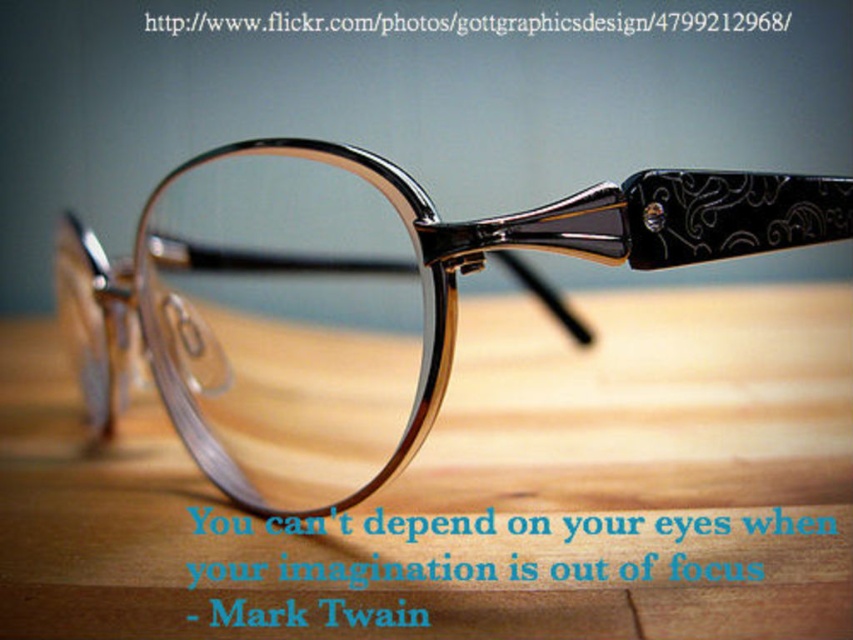
Question: Can you confirm if wooden table at center is positioned to the left of matte black glasses at center?

Choices:
 (A) yes
 (B) no

Answer: (B)

Question: Which point appears farthest from the camera in this image?

Choices:
 (A) (511, 243)
 (B) (479, 337)

Answer: (B)

Question: Which point is closer to the camera?

Choices:
 (A) wooden table at center
 (B) matte black glasses at center

Answer: (A)

Question: In this image, where is wooden table at center located relative to matte black glasses at center?

Choices:
 (A) left
 (B) right

Answer: (B)

Question: Does wooden table at center come in front of matte black glasses at center?

Choices:
 (A) no
 (B) yes

Answer: (B)

Question: Among these objects, which one is nearest to the camera?

Choices:
 (A) matte black glasses at center
 (B) wooden table at center

Answer: (B)